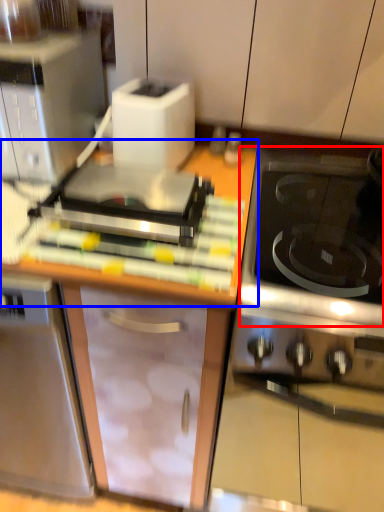
Question: Which of the following is the closest to the observer, gas stove (highlighted by a red box) or countertop (highlighted by a blue box)?

Choices:
 (A) gas stove
 (B) countertop

Answer: (A)